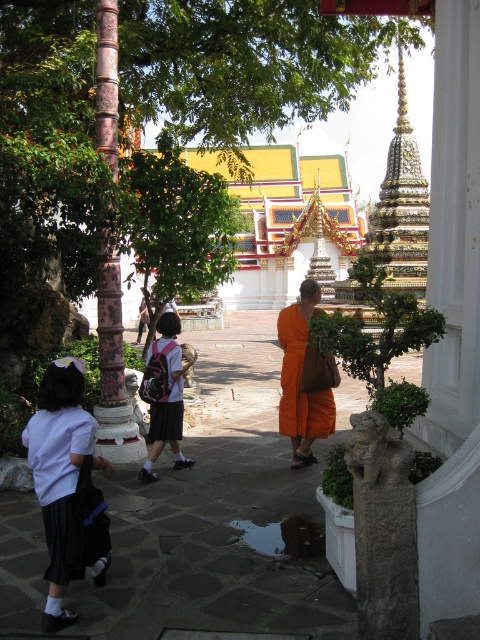
Is orange cloth at center behind matte orange robe at center?

No, orange cloth at center is in front of matte orange robe at center.

Is orange cloth at center above matte orange robe at center?

Yes, orange cloth at center is above matte orange robe at center.

Which is behind, point (295, 449) or point (175, 388)?

Point (175, 388)

Locate an element on the screen. orange cloth at center is located at coordinates (300, 380).

Which of these two, green leafy tree at center or white fabric skirt at lower left, stands shorter?

white fabric skirt at lower left is shorter.

Who is higher up, green leafy tree at center or white fabric skirt at lower left?

green leafy tree at center is above.

Does point (230, 220) come farther from viewer compared to point (57, 582)?

Yes.

Image resolution: width=480 pixels, height=640 pixels. Identify the location of green leafy tree at center. (175, 225).

Which is more to the left, matte pink backpack at center or matte orange robe at center?

matte pink backpack at center is more to the left.

Is matte pink backpack at center taller than matte orange robe at center?

Yes, matte pink backpack at center is taller than matte orange robe at center.

Who is more distant from viewer, (167, 410) or (173, 384)?

Point (173, 384)

Image resolution: width=480 pixels, height=640 pixels. Identify the location of matte pink backpack at center. (165, 394).